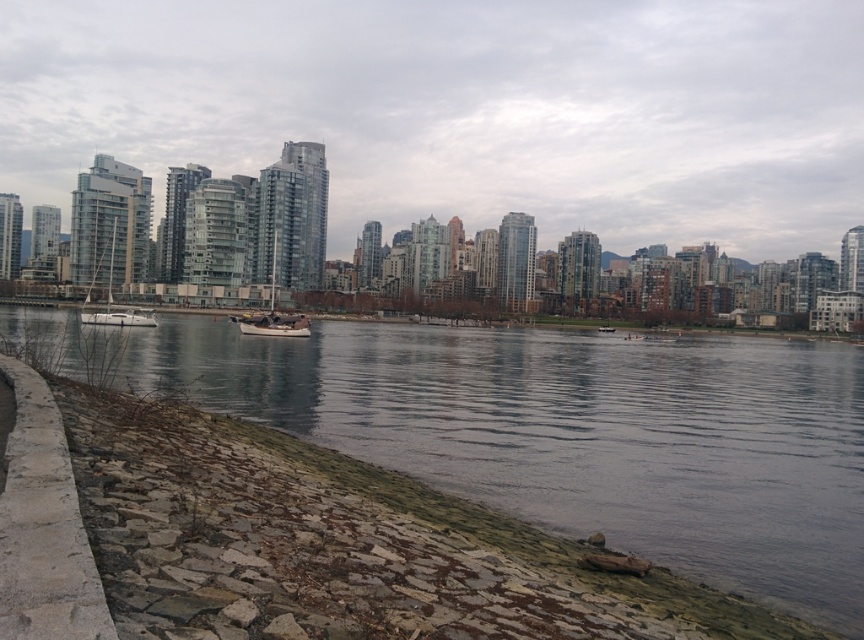
Consider the image. You are a photographer planning to capture both the white glossy sailboat at left and the wooden sailboat at center in a single shot. Based on their sizes, which boat should you position closer to the camera to ensure both appear equally sized in the photo?

The white glossy sailboat at left is shorter than the wooden sailboat at center. To make them appear equal in size in the photo, position the white glossy sailboat at left closer to the camera since it is smaller and the wooden sailboat at center farther away.